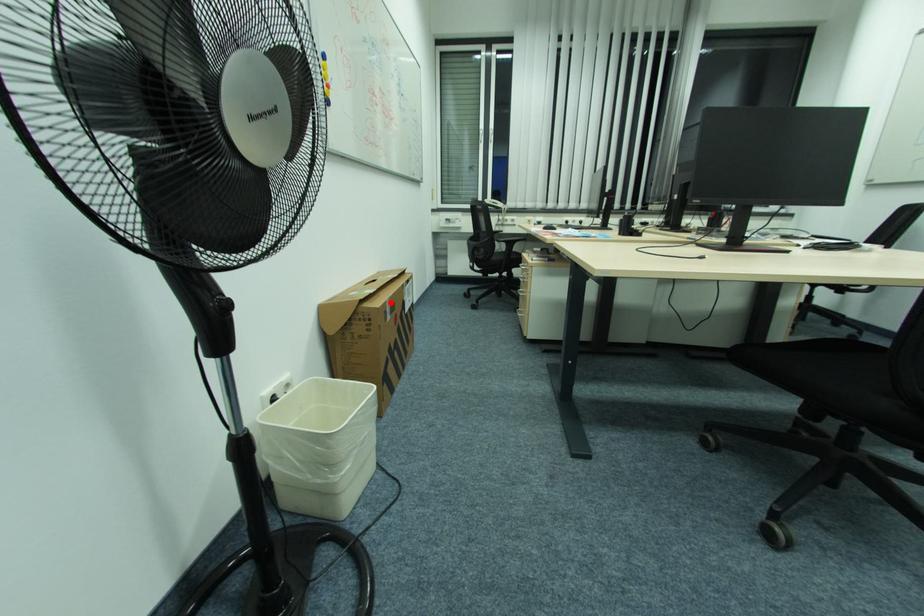
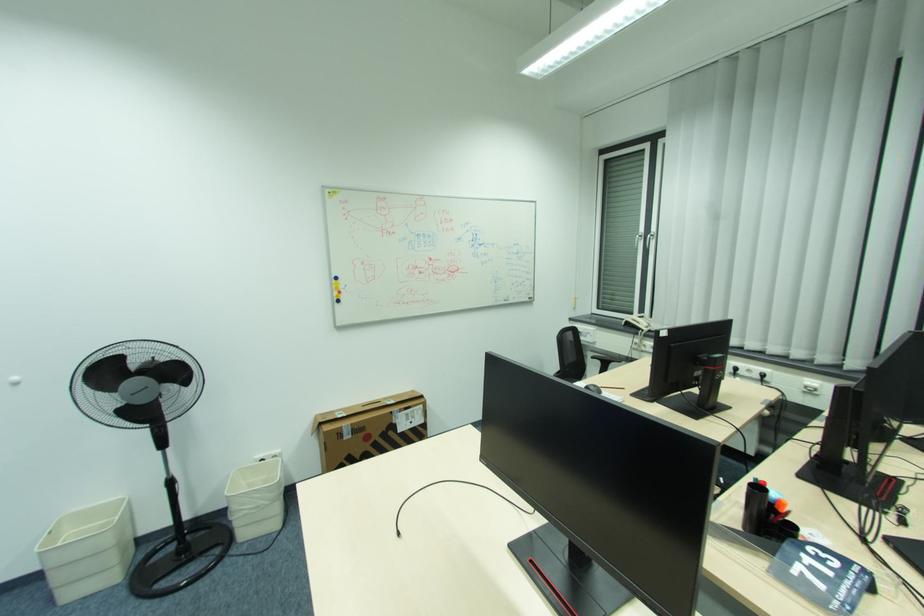
Question: I am providing you with two images of the same scene from different viewpoints. Given a red point in image1, look at the same physical point in image2. Is it:

Choices:
 (A) Closer to the viewpoint
 (B) Farther from the viewpoint

Answer: (B)